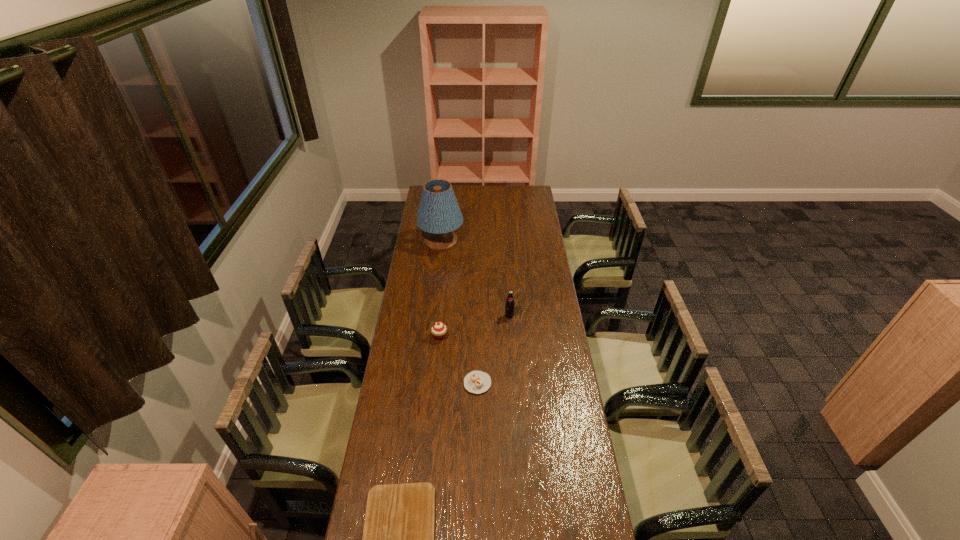
Where is `lampshade`? This screenshot has width=960, height=540. lampshade is located at coordinates (439, 214).

Find the location of `the tallest object`. the tallest object is located at coordinates (439, 214).

Locate an element on the screen. pop is located at coordinates (510, 304).

Locate an element on the screen. The width and height of the screenshot is (960, 540). the rightmost object is located at coordinates (510, 304).

Locate an element on the screen. The height and width of the screenshot is (540, 960). the left cupcake is located at coordinates (438, 329).

In order to click on the taller cupcake in this screenshot , I will do `click(438, 329)`.

Image resolution: width=960 pixels, height=540 pixels. I want to click on the shorter cupcake, so click(477, 382).

Locate an element on the screen. The image size is (960, 540). the nearer cupcake is located at coordinates (477, 382).

This screenshot has height=540, width=960. What are the coordinates of `vacant space located on the front of the lampshade` in the screenshot? It's located at (439, 266).

Locate an element on the screen. The image size is (960, 540). vacant space located on the front label of the second farthest object is located at coordinates (511, 332).